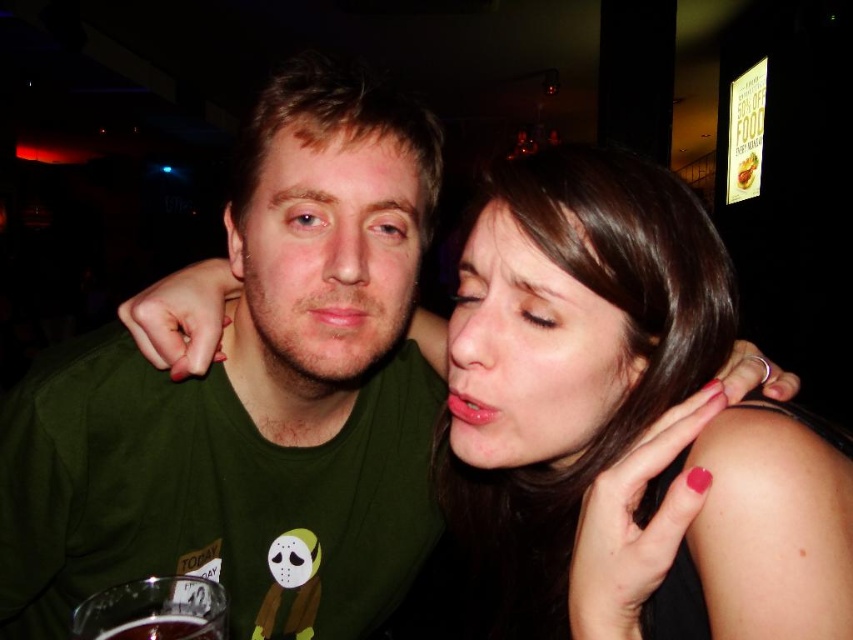
Question: Which of the following is the farthest from the observer?

Choices:
 (A) dark glass at lower left
 (B) smooth skin at center

Answer: (B)

Question: Observing the image, what is the correct spatial positioning of smooth skin at center in reference to dark glass at lower left?

Choices:
 (A) right
 (B) left

Answer: (A)

Question: Can you confirm if smooth skin at center is wider than dark glass at lower left?

Choices:
 (A) no
 (B) yes

Answer: (B)

Question: Which object appears farthest from the camera in this image?

Choices:
 (A) dark glass at lower left
 (B) smooth skin at center

Answer: (B)

Question: Observing the image, what is the correct spatial positioning of smooth skin at center in reference to dark glass at lower left?

Choices:
 (A) left
 (B) right

Answer: (B)